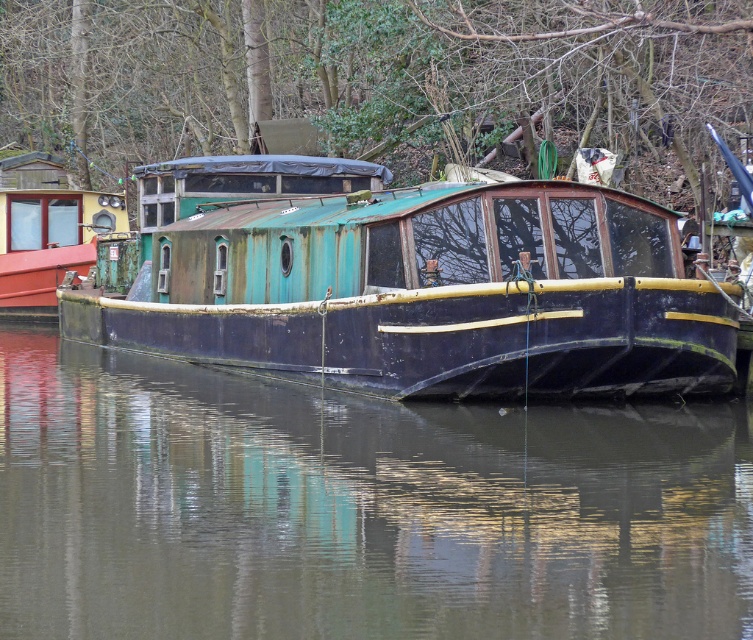
From the picture: You are a photographer standing on the dock and want to capture the reflection of the rusty metal boat at center in the smooth dark water at center. Is the boat positioned above the water where its reflection would appear?

Yes, the rusty metal boat at center is above the smooth dark water at center, so its reflection should appear on the water surface.

You are standing on the dock and want to reach a specific point in the water marked as point (284, 284). If your maximum comfortable walking distance on the dock is 20 meters, will you be able to reach that point comfortably?

The distance of point (284, 284) from the viewer is 22.28 meters, which exceeds your maximum comfortable walking distance of 20 meters. Therefore, you will not be able to reach that point comfortably.